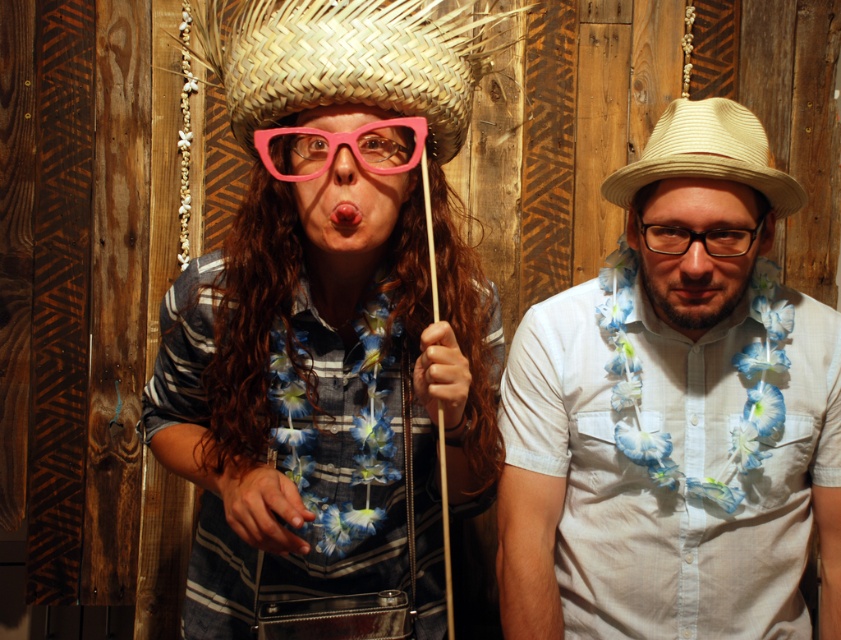
Question: Does matte straw hat at center have a greater width compared to pink matte lips at center?

Choices:
 (A) no
 (B) yes

Answer: (B)

Question: Does braided straw cowboy hat at center have a larger size compared to pink matte lips at center?

Choices:
 (A) no
 (B) yes

Answer: (B)

Question: Among these objects, which one is nearest to the camera?

Choices:
 (A) matte pink glasses at center
 (B) pink matte plastic nose at center
 (C) brown matte beard at center

Answer: (A)

Question: Which point appears closest to the camera in this image?

Choices:
 (A) (348, 221)
 (B) (701, 257)
 (C) (384, 202)
 (D) (427, 54)

Answer: (D)

Question: Can you confirm if matte straw hat at center is positioned to the left of pink plastic glasses at center?

Choices:
 (A) no
 (B) yes

Answer: (B)

Question: Which object is positioned closest to the braided straw cowboy hat at center?

Choices:
 (A) pink plastic glasses at center
 (B) matte pink glasses at center
 (C) matte straw hat at center

Answer: (A)